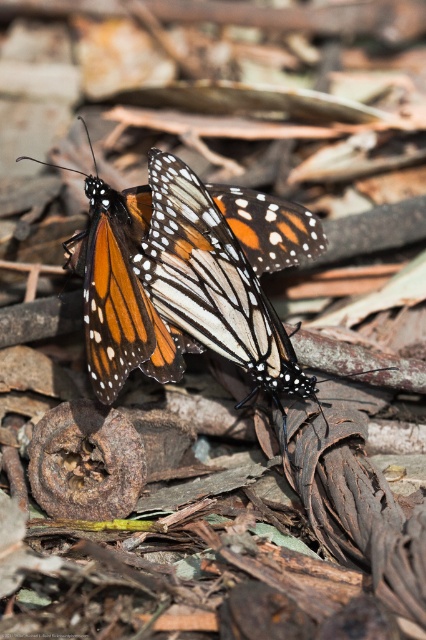
You are an entomologist observing two butterflies in the image. Which butterfly is shorter in height between the orange and white butterfly at center and the orange and white spotted butterfly at center?

The orange and white butterfly at center is not as tall as the orange and white spotted butterfly at center, so the orange and white butterfly at center is shorter in height.

You are a nature photographer aiming to capture a closeup of the orange and white butterfly at center. Based on its coordinates at point 0.458, 0.286, where exactly should you focus your camera lens to ensure the butterfly is in sharp focus?

You should focus your camera lens precisely at the coordinates (121, 292) where the orange and white butterfly at center is located to ensure it is in sharp focus.

You are a nature photographer aiming to capture both the orange and white butterfly at center and the orange and white spotted butterfly at center in a single frame. Given that your camera has a maximum focus range of 1.5 inches, can you focus on both butterflies simultaneously?

The distance between the orange and white butterfly at center and the orange and white spotted butterfly at center is 1.53 inches. Since the camera can only focus within 1.5 inches, the butterflies are slightly too far apart to be captured in focus together.